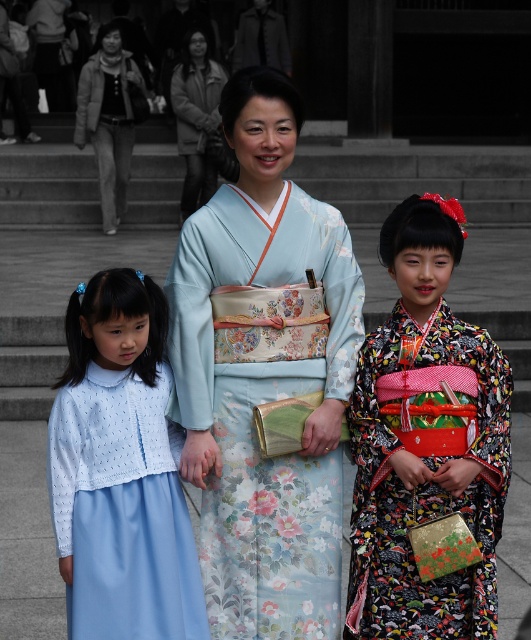
Question: Which of the following is the farthest from the observer?

Choices:
 (A) (140, 273)
 (B) (475, 566)
 (C) (297, 296)

Answer: (C)

Question: Is light blue floral kimono at center wider than floral silk kimono at center?

Choices:
 (A) no
 (B) yes

Answer: (B)

Question: Which point is farther to the camera?

Choices:
 (A) light blue floral kimono at center
 (B) light blue satin dress at left
 (C) floral silk kimono at center

Answer: (A)

Question: Which of the following is the closest to the observer?

Choices:
 (A) (367, 371)
 (B) (78, 412)
 (C) (172, 344)

Answer: (B)

Question: Does light blue satin dress at left appear on the left side of floral silk kimono at center?

Choices:
 (A) no
 (B) yes

Answer: (B)

Question: Can you confirm if light blue floral kimono at center is positioned above floral silk kimono at center?

Choices:
 (A) no
 (B) yes

Answer: (B)